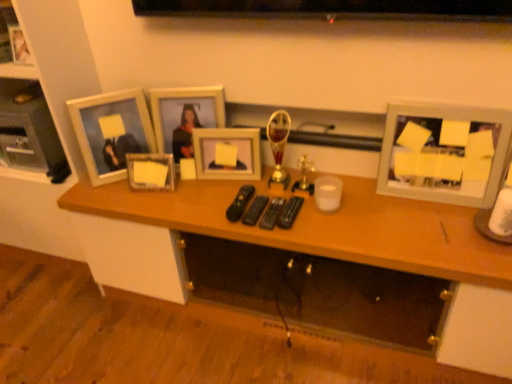
Identify the location of free area behind black plastic remote control at center, placed as the fourth remote control when sorted from left to right. (278, 185).